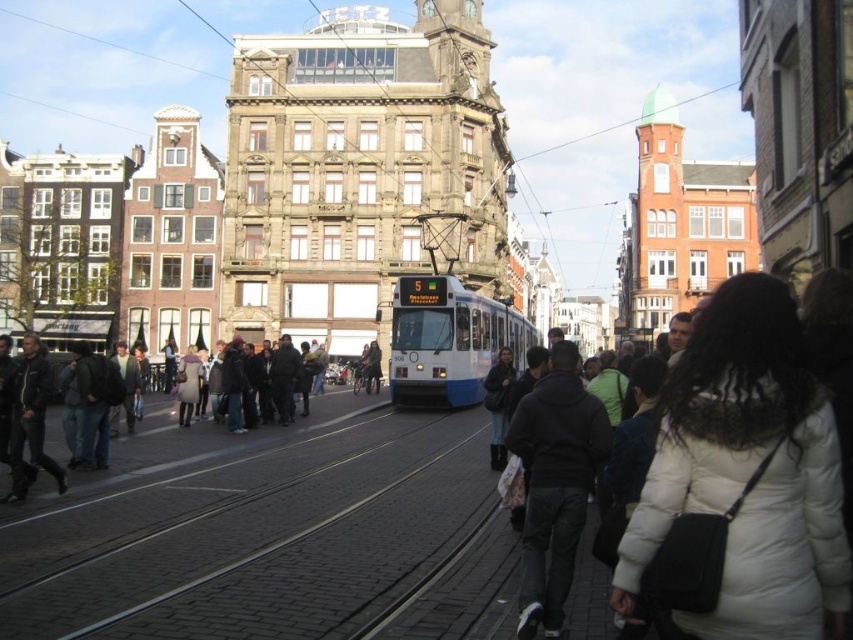
Question: Which of the following is the closest to the observer?

Choices:
 (A) white glossy tram at center
 (B) dark gray leather jacket at left
 (C) dark gray clothing at left

Answer: (B)

Question: Which object is closer to the camera taking this photo?

Choices:
 (A) dark gray fabric crowd at center left
 (B) white puffy coat at lower right
 (C) dark blue jacket at center
 (D) dark gray clothing at left

Answer: (B)

Question: Can you confirm if dark gray fabric crowd at center left is thinner than dark blue jacket at center?

Choices:
 (A) no
 (B) yes

Answer: (A)

Question: Is dark gray fabric crowd at center left smaller than dark gray clothing at left?

Choices:
 (A) yes
 (B) no

Answer: (A)

Question: Which point is farther from the camera taking this photo?

Choices:
 (A) (236, 342)
 (B) (39, 401)

Answer: (A)

Question: Does white puffy coat at lower right appear on the right side of dark blue jacket at center?

Choices:
 (A) yes
 (B) no

Answer: (A)